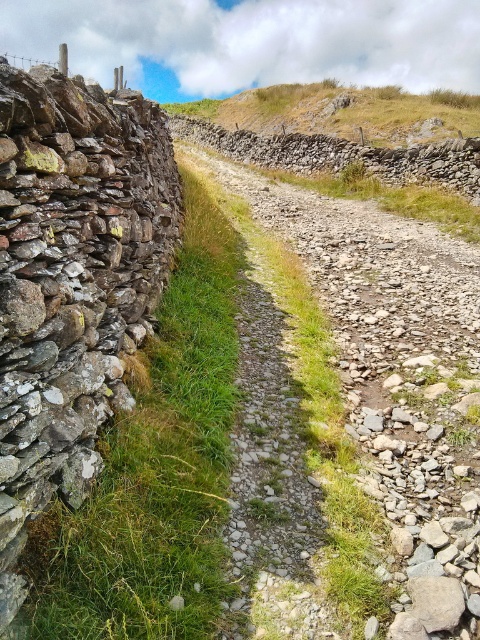
You are a hiker trying to cross this rocky path. You need to know which area has a narrower width between the green grass at left and the grassy hillside at upper center to choose the safest path. Which one is narrower?

The green grass at left has a lesser width compared to the grassy hillside at upper center, so the green grass at left is narrower and safer to cross.

You are a hiker carrying a heavy backpack and need to choose between the gravel path at center and the grassy hillside at upper center for your route. Which path is shorter in length?

The gravel path at center is shorter than the grassy hillside at upper center, so you should choose the gravel path at center for a shorter route.

You are a hiker who needs to cross from the green grass at left to the grassy hillside at upper center. Given that your average walking speed is 1.5 meters per second, how many seconds will it take you to reach the hillside?

The distance between the green grass at left and the grassy hillside at upper center is 39.82 meters. At a speed of 1.5 meters per second, the time required is 39.82 divided by 1.5, which equals approximately 26.55 seconds. Therefore, it will take about 26.6 seconds to reach the hillside.